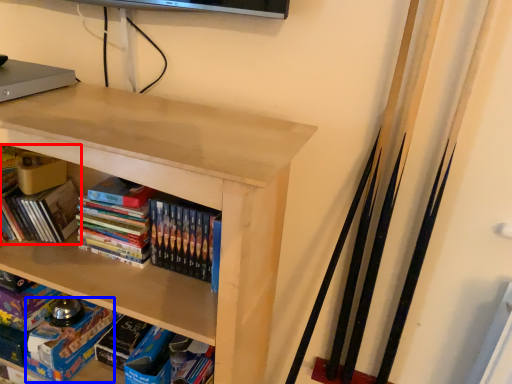
Question: Among these objects, which one is nearest to the camera, book (highlighted by a red box) or paperback book (highlighted by a blue box)?

Choices:
 (A) book
 (B) paperback book

Answer: (A)